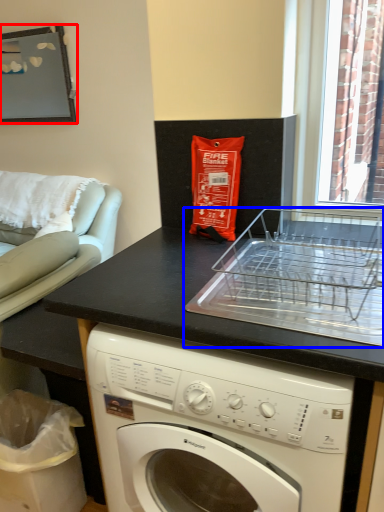
Question: Among these objects, which one is farthest to the camera, picture frame (highlighted by a red box) or appliance (highlighted by a blue box)?

Choices:
 (A) picture frame
 (B) appliance

Answer: (A)